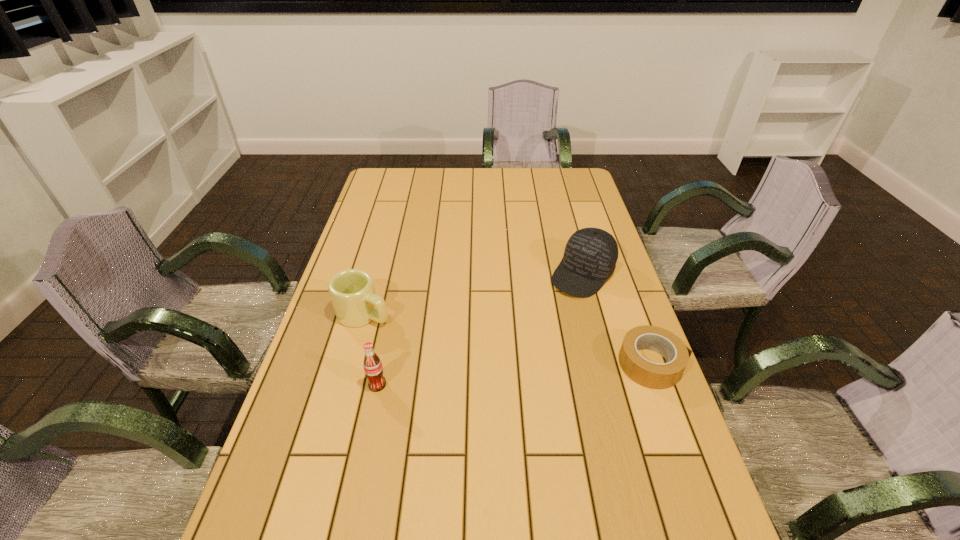
The width and height of the screenshot is (960, 540). In the image, there is a desktop. In order to click on vacant region at the far right corner in this screenshot , I will do `click(581, 188)`.

Image resolution: width=960 pixels, height=540 pixels. Identify the location of vacant space that is in between the duct tape and the third tallest object. click(508, 339).

You are a GUI agent. You are given a task and a screenshot of the screen. Output one action in this format:
    pyautogui.click(x=<x>, y=<y>)
    Task: Click on the empty space that is in between the shortest object and the baseball cap
    The height and width of the screenshot is (540, 960).
    Given the screenshot: What is the action you would take?
    pyautogui.click(x=617, y=319)

You are a GUI agent. You are given a task and a screenshot of the screen. Output one action in this format:
    pyautogui.click(x=<x>, y=<y>)
    Task: Click on the vacant space that's between the mug and the farthest object
    The width and height of the screenshot is (960, 540).
    Given the screenshot: What is the action you would take?
    pyautogui.click(x=473, y=294)

Locate an element on the screen. vacant area that lies between the farthest object and the soda is located at coordinates (480, 329).

I want to click on vacant space that is in between the soda and the baseball cap, so click(x=480, y=329).

Where is `empty location between the shortest object and the third nearest object`? The height and width of the screenshot is (540, 960). empty location between the shortest object and the third nearest object is located at coordinates (508, 339).

This screenshot has width=960, height=540. What are the coordinates of `free spot between the duct tape and the second farthest object` in the screenshot? It's located at (508, 339).

Identify the location of vacant area between the soda and the duct tape. (515, 374).

Find the location of a particular element. The height and width of the screenshot is (540, 960). empty location between the duct tape and the baseball cap is located at coordinates (617, 319).